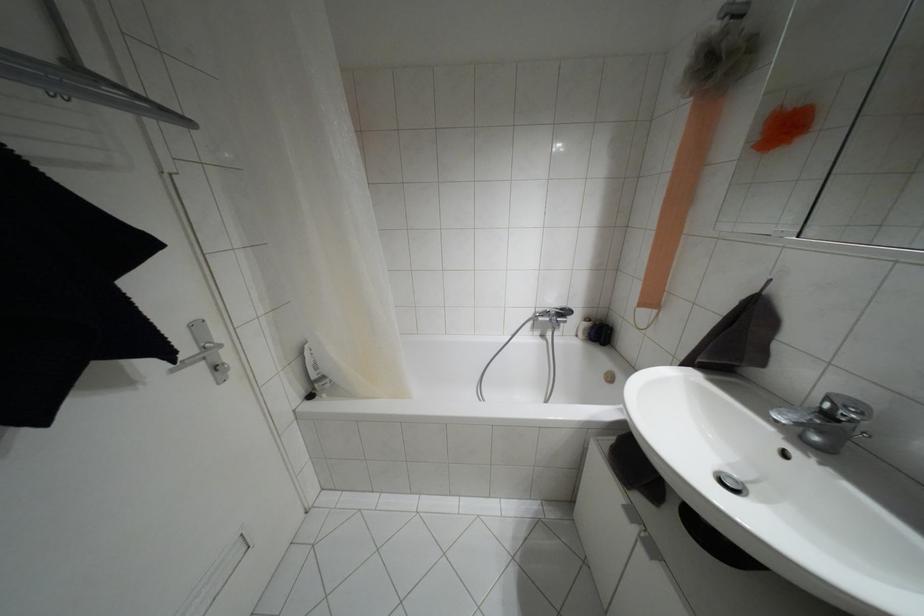
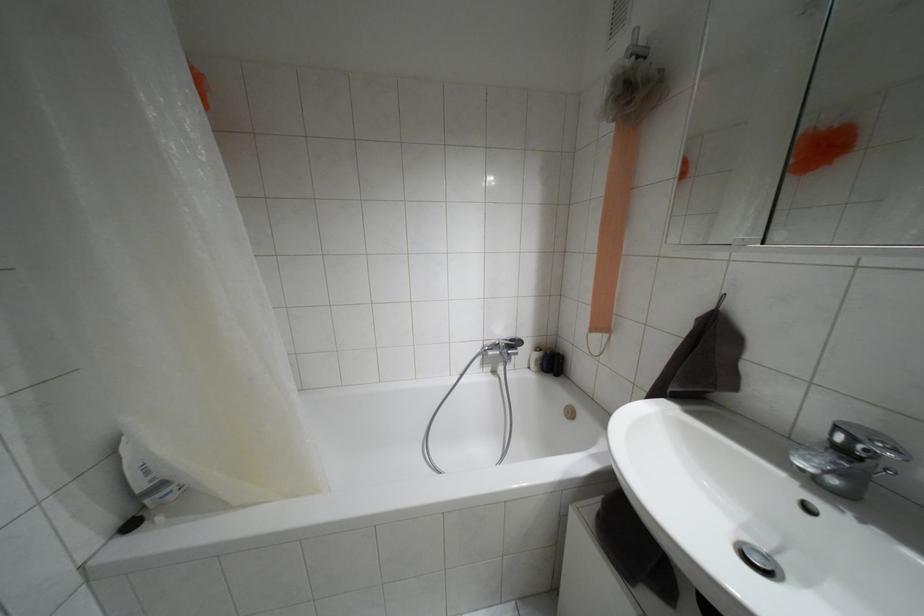
Question: Which direction would the cameraman need to move to produce the second image? Reply with the corresponding letter.

Choices:
 (A) Left
 (B) Right
 (C) Forward
 (D) Backward

Answer: (C)